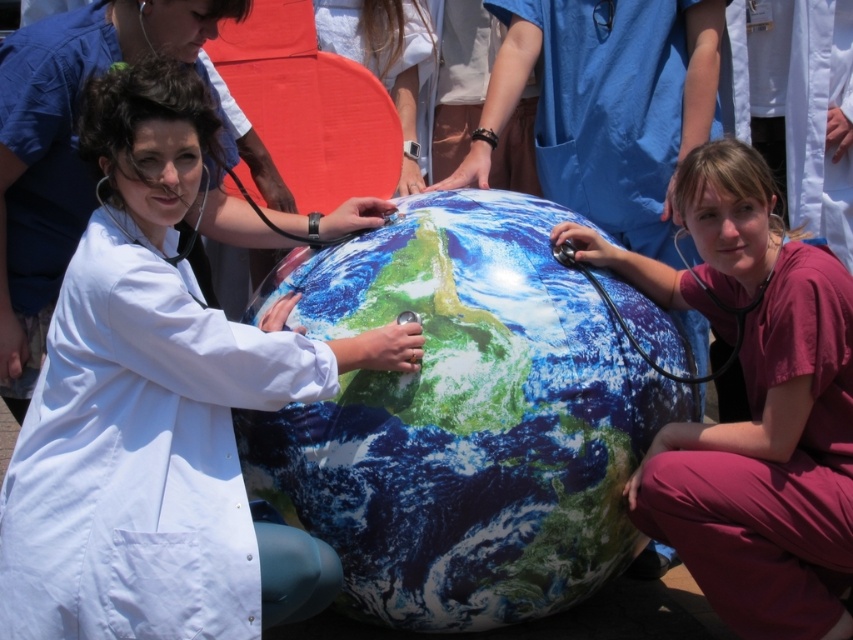
Consider the image. Is earth-like globe at center to the right of matte pink scrubs at lower right from the viewer's perspective?

Incorrect, earth-like globe at center is not on the right side of matte pink scrubs at lower right.

Who is positioned more to the left, earth-like globe at center or matte pink scrubs at lower right?

earth-like globe at center is more to the left.

Does point (451, 516) come closer to viewer compared to point (688, 422)?

Yes, it is.

Where is `earth-like globe at center`? earth-like globe at center is located at coordinates (462, 419).

Identify the location of earth-like globe at center. The width and height of the screenshot is (853, 640). (462, 419).

Which is in front, point (318, 289) or point (114, 218)?

Point (114, 218) is in front.

Locate an element on the screen. earth-like globe at center is located at coordinates (462, 419).

Which is in front, point (280, 237) or point (204, 202)?

Point (204, 202) is more forward.

Who is lower down, white lab coat at left or black rubber stethoscope at left?

white lab coat at left is lower down.

Is point (154, 561) more distant than point (199, 211)?

No.

Where is `white lab coat at left`? white lab coat at left is located at coordinates (158, 408).